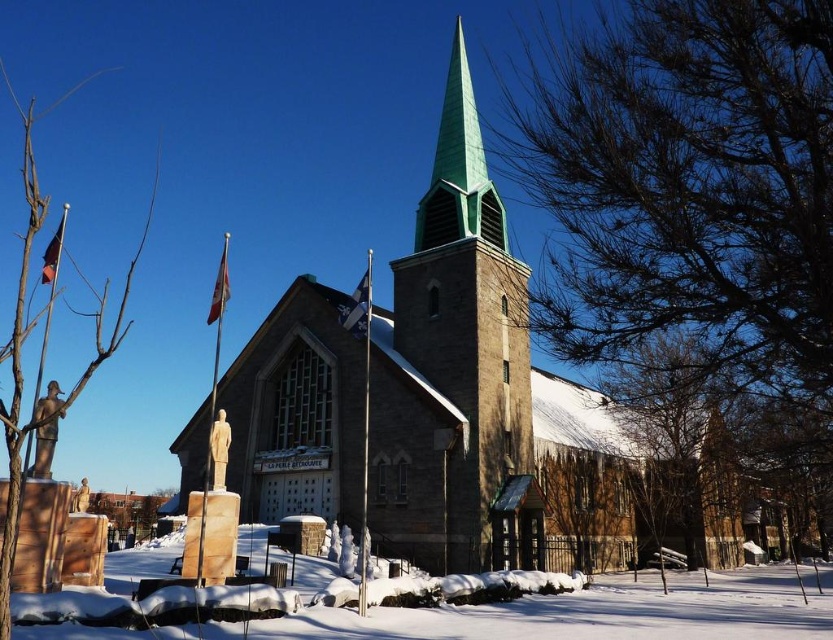
Can you confirm if brown textured tree at upper right is wider than brown wood tree at left?

No, brown textured tree at upper right is not wider than brown wood tree at left.

Is point (582, 225) farther from viewer compared to point (8, 556)?

Yes, point (582, 225) is farther from viewer.

Locate an element on the screen. This screenshot has width=833, height=640. brown textured tree at upper right is located at coordinates (691, 200).

Is brown textured tree at upper right bigger than white powdery snow at lower center?

Correct, brown textured tree at upper right is larger in size than white powdery snow at lower center.

Is point (677, 20) positioned behind point (716, 600)?

No.

Locate an element on the screen. brown textured tree at upper right is located at coordinates (691, 200).

Is white powdery snow at lower center to the right of brown wood tree at left from the viewer's perspective?

Indeed, white powdery snow at lower center is positioned on the right side of brown wood tree at left.

Who is higher up, white powdery snow at lower center or brown wood tree at left?

brown wood tree at left is higher up.

Identify the location of white powdery snow at lower center. click(597, 612).